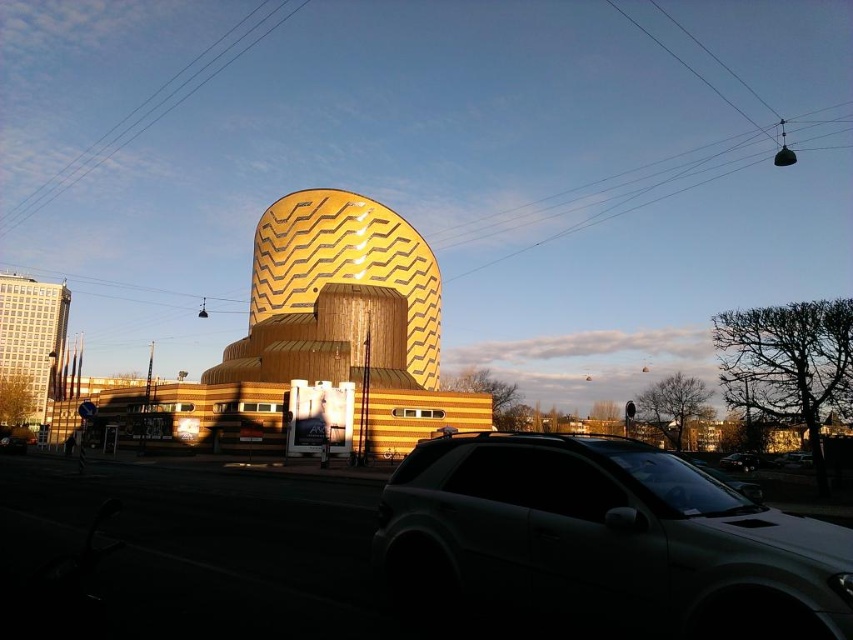
Is gold textured dome at center wider than satin silver suv at center?

Indeed, gold textured dome at center has a greater width compared to satin silver suv at center.

Which is in front, point (357, 417) or point (808, 454)?

Positioned in front is point (808, 454).

The width and height of the screenshot is (853, 640). Find the location of `gold textured dome at center`. gold textured dome at center is located at coordinates (317, 339).

How far apart are matte black suv at lower right and gold textured dome at center?

A distance of 30.75 meters exists between matte black suv at lower right and gold textured dome at center.

Can you confirm if matte black suv at lower right is positioned below gold textured dome at center?

Indeed, matte black suv at lower right is positioned under gold textured dome at center.

Is point (587, 573) farther from camera compared to point (350, 328)?

No, it is in front of (350, 328).

What are the coordinates of `matte black suv at lower right` in the screenshot? It's located at (602, 541).

Between matte black suv at lower right and satin black suv at center, which one is positioned lower?

satin black suv at center is lower down.

Who is shorter, matte black suv at lower right or satin black suv at center?

Standing shorter between the two is satin black suv at center.

Which is behind, point (596, 548) or point (747, 456)?

The point (747, 456) is more distant.

The width and height of the screenshot is (853, 640). Identify the location of matte black suv at lower right. (602, 541).